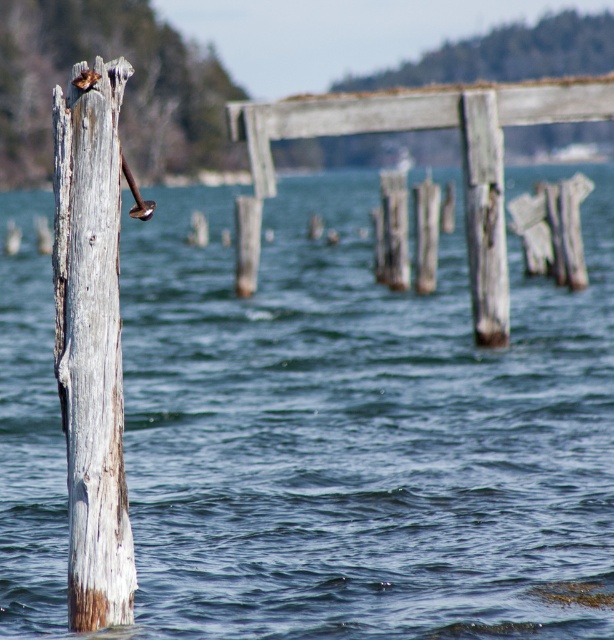
Can you confirm if clear blue water at center is positioned below weathered wood dock at center?

No, clear blue water at center is not below weathered wood dock at center.

This screenshot has height=640, width=614. What do you see at coordinates (360, 428) in the screenshot? I see `clear blue water at center` at bounding box center [360, 428].

Between point (324, 508) and point (268, 132), which one is positioned in front?

Point (324, 508)

Find the location of a particular element. clear blue water at center is located at coordinates (360, 428).

Is gray weathered wood post at left thinner than weathered wood dock at center?

Yes, gray weathered wood post at left is thinner than weathered wood dock at center.

Is point (93, 333) less distant than point (422, 108)?

Yes, point (93, 333) is in front of point (422, 108).

What do you see at coordinates (91, 344) in the screenshot?
I see `gray weathered wood post at left` at bounding box center [91, 344].

What are the coordinates of `gray weathered wood post at left` in the screenshot? It's located at (91, 344).

Who is shorter, clear blue water at center or gray weathered wood post at left?

gray weathered wood post at left

Does clear blue water at center have a larger size compared to gray weathered wood post at left?

Indeed, clear blue water at center has a larger size compared to gray weathered wood post at left.

Is point (328, 268) positioned after point (122, 452)?

Yes, point (328, 268) is farther from viewer.

You are a GUI agent. You are given a task and a screenshot of the screen. Output one action in this format:
    pyautogui.click(x=<x>, y=<y>)
    Task: Click on the clear blue water at center
    
    Given the screenshot: What is the action you would take?
    pyautogui.click(x=360, y=428)